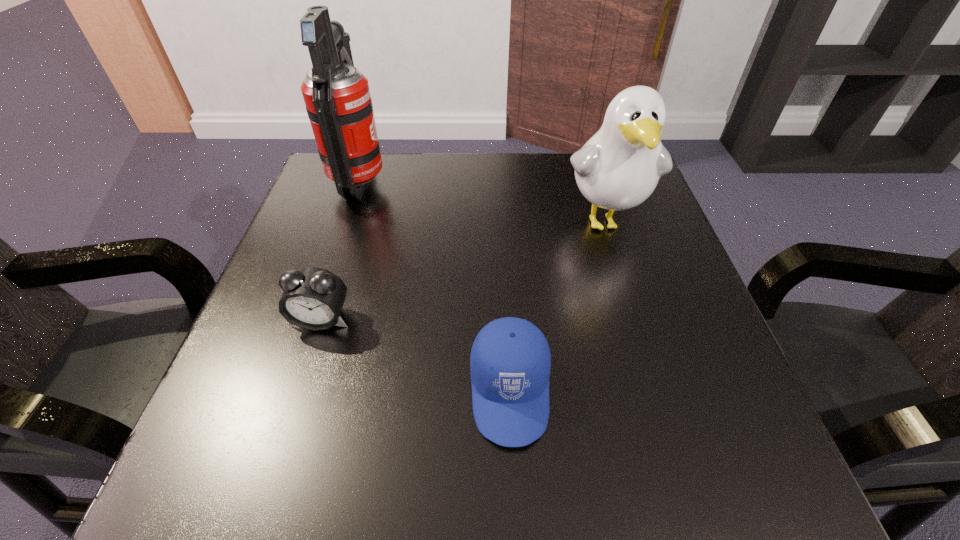
This screenshot has width=960, height=540. I want to click on vacant space at the right edge of the desktop, so click(x=657, y=404).

In the image, there is a desktop. Where is `free space at the near left corner`? This screenshot has height=540, width=960. free space at the near left corner is located at coordinates (280, 495).

At what (x,y) coordinates should I click in order to perform the action: click on vacant region at the near right corner of the desktop. Please return your answer as a coordinate pair (x, y). The height and width of the screenshot is (540, 960). Looking at the image, I should click on (682, 454).

Where is `free space between the fire extinguisher and the third shortest object`? free space between the fire extinguisher and the third shortest object is located at coordinates (482, 201).

Identify the location of empty space that is in between the third farthest object and the tallest object. (340, 251).

I want to click on vacant space that's between the third farthest object and the second tallest object, so click(x=463, y=270).

Locate an element on the screen. Image resolution: width=960 pixels, height=540 pixels. empty location between the second nearest object and the gull is located at coordinates (463, 270).

This screenshot has width=960, height=540. I want to click on free space between the tallest object and the alarm clock, so click(x=340, y=251).

Find the location of a particular element. This screenshot has width=960, height=540. empty space that is in between the nearest object and the fire extinguisher is located at coordinates (435, 287).

The height and width of the screenshot is (540, 960). I want to click on free spot between the alarm clock and the fire extinguisher, so click(340, 251).